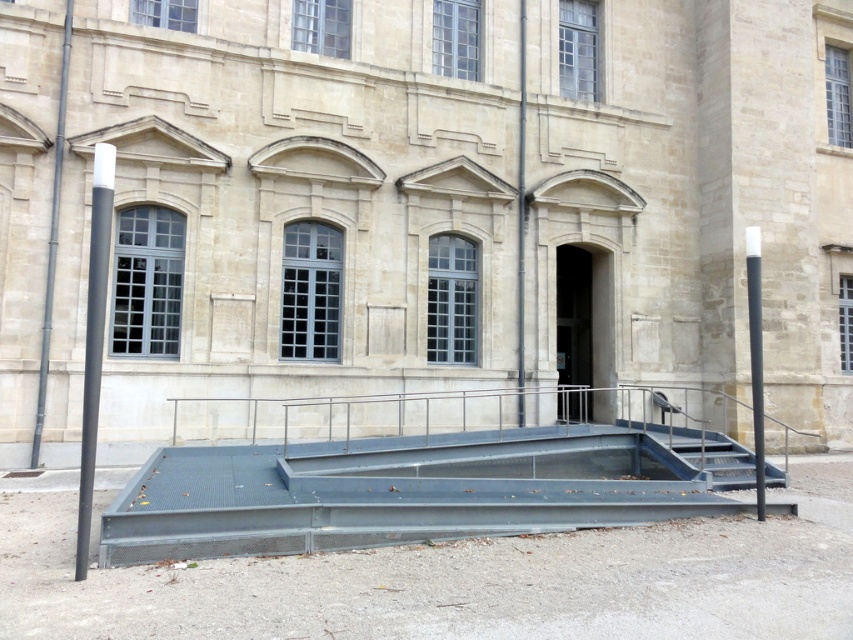
Between metallic gray stairs at lower right and metallic gray pole at left, which one appears on the right side from the viewer's perspective?

From the viewer's perspective, metallic gray stairs at lower right appears more on the right side.

Does metallic gray stairs at lower right appear over metallic gray pole at left?

No.

The height and width of the screenshot is (640, 853). What do you see at coordinates (705, 452) in the screenshot? I see `metallic gray stairs at lower right` at bounding box center [705, 452].

Locate an element on the screen. The width and height of the screenshot is (853, 640). metallic gray stairs at lower right is located at coordinates (705, 452).

Based on the photo, who is positioned more to the left, metallic gray pole at left or black matte pole at right?

A: From the viewer's perspective, metallic gray pole at left appears more on the left side.

Does metallic gray pole at left have a lesser height compared to black matte pole at right?

Yes.

Is point (61, 104) positioned behind point (759, 486)?

Yes, it is.

This screenshot has width=853, height=640. In order to click on metallic gray pole at left in this screenshot , I will do `click(51, 237)`.

The image size is (853, 640). Identify the location of metallic gray stairs at center. (415, 490).

Image resolution: width=853 pixels, height=640 pixels. What do you see at coordinates (415, 490) in the screenshot? I see `metallic gray stairs at center` at bounding box center [415, 490].

Image resolution: width=853 pixels, height=640 pixels. Identify the location of metallic gray stairs at center. (415, 490).